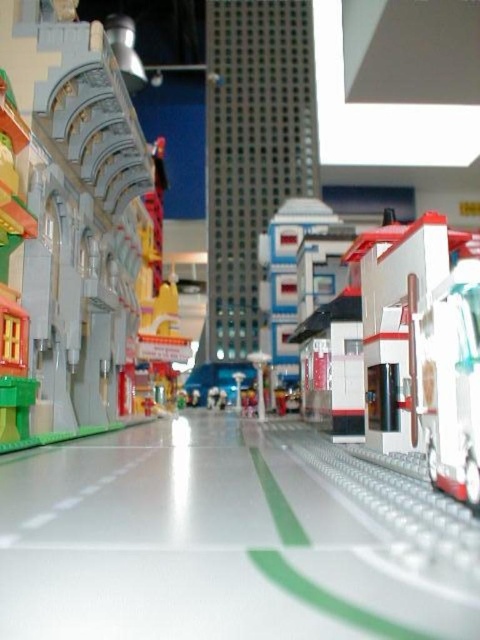
Which of these two, smooth gray building at left or white plastic bus at center-right, stands taller?

smooth gray building at left

Consider the image. Measure the distance between smooth gray building at left and camera.

The distance of smooth gray building at left from camera is 3.84 feet.

Is point (31, 36) in front of point (441, 461)?

That is False.

Find the location of a particular element. smooth gray building at left is located at coordinates (76, 228).